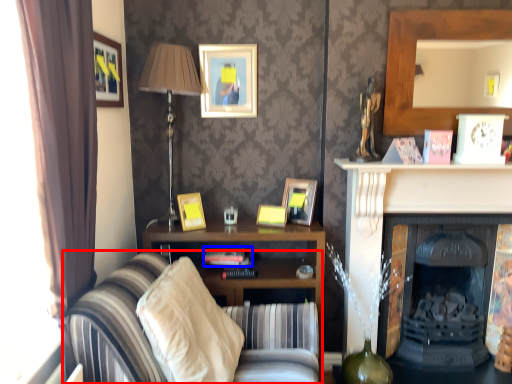
Question: Which point is closer to the camera, studio couch (highlighted by a red box) or book (highlighted by a blue box)?

Choices:
 (A) studio couch
 (B) book

Answer: (A)